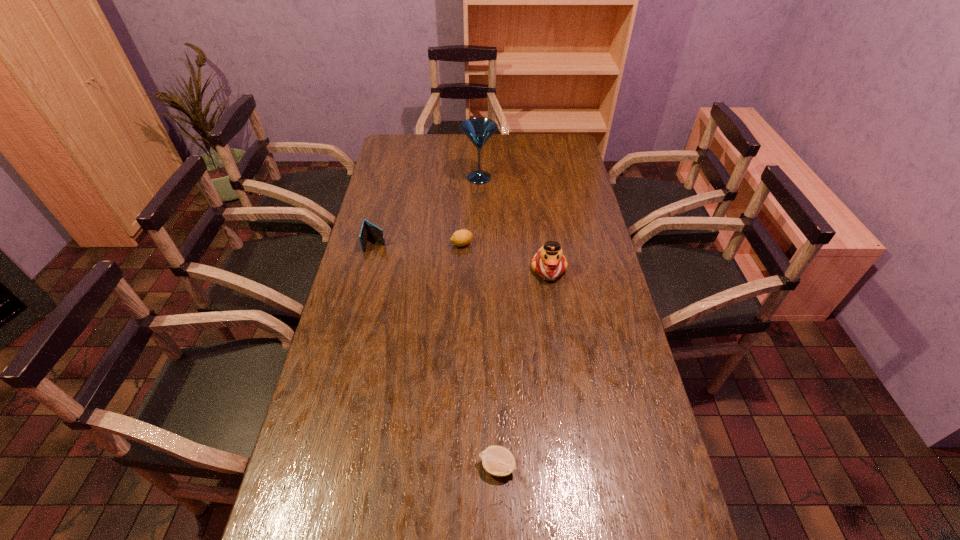
In order to click on vacant space located on the back of the tallest object in this screenshot , I will do `click(479, 137)`.

Where is `free space located 0.350m on the face of the duck`? free space located 0.350m on the face of the duck is located at coordinates (565, 376).

In order to click on vacant space situated on the exterior surface of the third tallest object in this screenshot , I will do `click(355, 329)`.

Locate an element on the screen. blank space located at the stem end of the left lemon is located at coordinates click(531, 244).

Locate an element on the screen. free location located on the left of the nearest object is located at coordinates (332, 466).

This screenshot has width=960, height=540. In order to click on object present at the left edge in this screenshot , I will do `click(368, 229)`.

Locate an element on the screen. Image resolution: width=960 pixels, height=540 pixels. object that is positioned at the right edge is located at coordinates (549, 263).

This screenshot has width=960, height=540. In order to click on free spot at the far edge of the desktop in this screenshot , I will do `click(471, 157)`.

Locate an element on the screen. This screenshot has width=960, height=540. vacant region at the left edge of the desktop is located at coordinates (387, 244).

In the image, there is a desktop. Where is `vacant space at the right edge`? This screenshot has width=960, height=540. vacant space at the right edge is located at coordinates (636, 409).